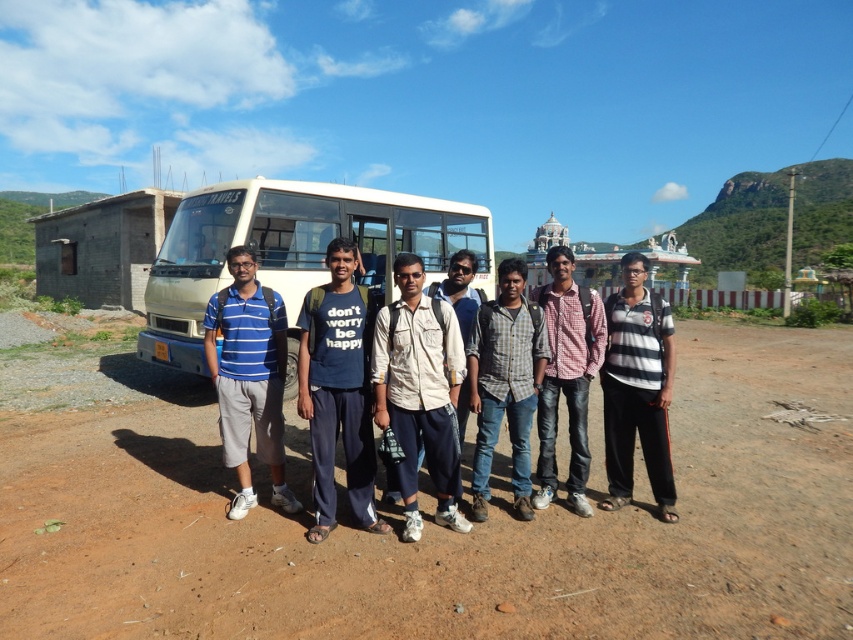
Question: Does white matte bus at center appear on the left side of dark blue cotton t-shirt at center?

Choices:
 (A) no
 (B) yes

Answer: (B)

Question: Does striped cotton shirt at center come in front of checkered shirt at center?

Choices:
 (A) yes
 (B) no

Answer: (A)

Question: Which of the following is the farthest from the observer?

Choices:
 (A) (641, 257)
 (B) (136, 342)
 (C) (364, 528)

Answer: (B)

Question: Which object appears farthest from the camera in this image?

Choices:
 (A) dark blue cotton t-shirt at center
 (B) light brown cotton shirt at center

Answer: (B)

Question: Can you confirm if white matte bus at center is positioned below beige cotton shirt at center?

Choices:
 (A) no
 (B) yes

Answer: (A)

Question: Which object is the farthest from the brown sandy dirt at center?

Choices:
 (A) white matte bus at center
 (B) beige cotton shirt at center
 (C) dark blue cotton t-shirt at center
 (D) checkered fabric shirt at center

Answer: (A)